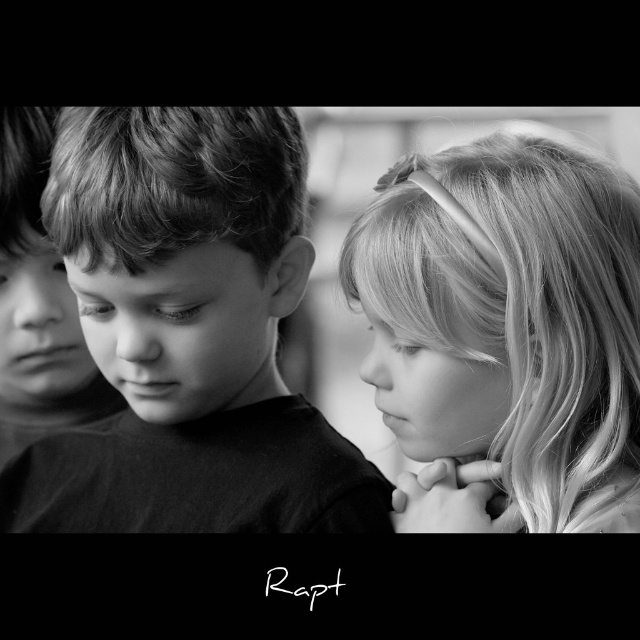
In the black and white photo, there are three children. The central boy in dark shirt, the girl with light headband on the right, and another child on the left. A point at coordinates (506, 332) marks a feature. Which child does this point belong to?

The point at (506, 332) indicates smooth blonde hair at upper right, which belongs to the girl with the light headband on the right.

Looking at this image, you are a photographer analyzing the composition of this black and white photo. You notice the smooth blonde hair at upper right and the black matte boy at left. Which object is positioned further to the right in the frame?

The smooth blonde hair at upper right is positioned further to the right in the frame compared to the black matte boy at left.